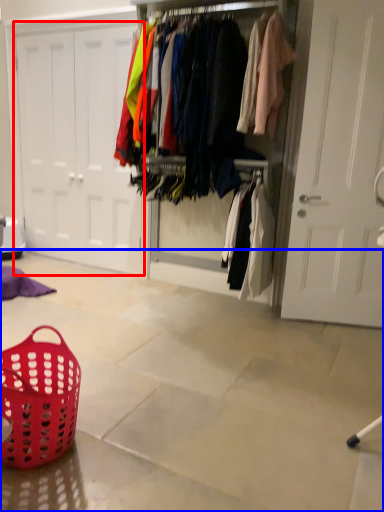
Question: Which of the following is the closest to the observer, door (highlighted by a red box) or concrete (highlighted by a blue box)?

Choices:
 (A) door
 (B) concrete

Answer: (B)